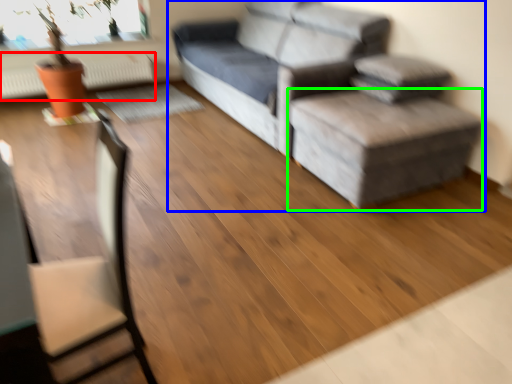
Question: Which object is positioned farthest from radiator (highlighted by a red box)? Select from studio couch (highlighted by a blue box) and stool (highlighted by a green box).

Choices:
 (A) studio couch
 (B) stool

Answer: (B)